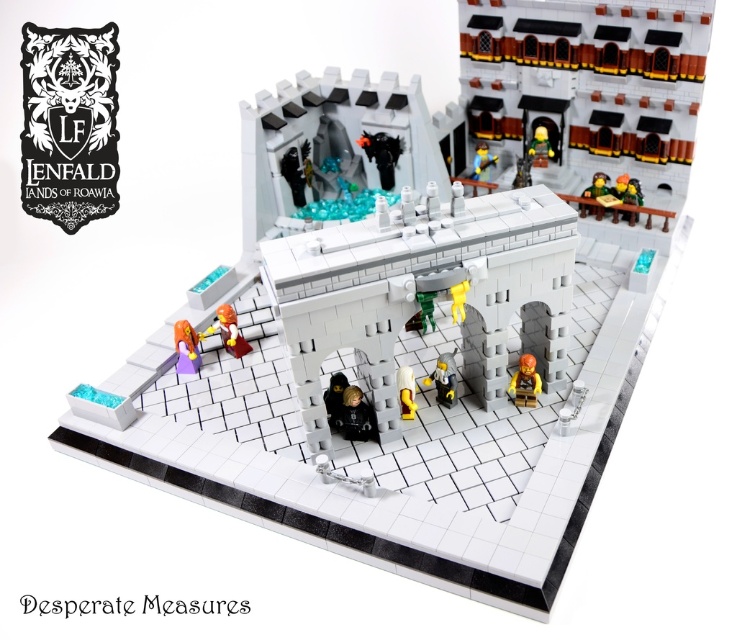
You are a visitor in the LEGO castle courtyard. You see the purple matte princess at lower left and the green plastic minifigure at upper right. Which character is positioned higher in the scene?

The green plastic minifigure at upper right is positioned higher in the scene than the purple matte princess at lower left.

You are a visitor in the LEGO castle courtyard. You see the purple matte princess at lower left. Where exactly is she positioned in the courtyard?

The purple matte princess at lower left is located at point coordinates of 0.544 on the x axis and 0.254 on the y axis.

You are a visitor in this LEGO castle courtyard. You notice the purple matte princess at lower left and the green plastic minifigure at upper right. Which of these two figures is larger in size?

The purple matte princess at lower left is bigger than the green plastic minifigure at upper right.